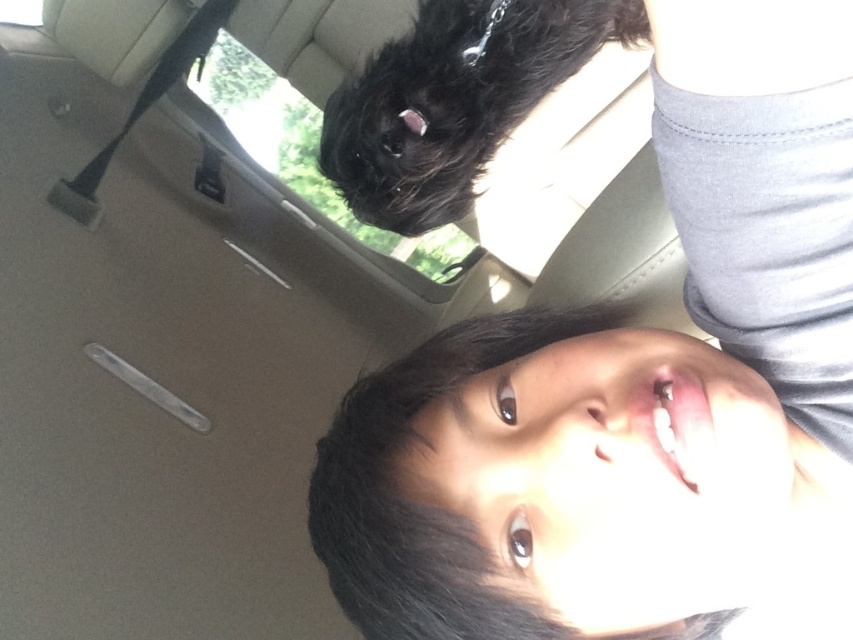
You are a passenger in the backseat of a car. You notice a smooth skin face at center and a transparent glass window at upper center. Which object is closer to the camera?

The smooth skin face at center is closer to the camera because it is positioned below the transparent glass window at upper center, meaning it is in front of the window.

From the picture: You are sitting in the backseat of a car and want to reach a point that is 23.00 inches away from you. The coordinates of this point are given as point (415,422). Can you estimate whether this point is within your arm reach?

The point (415,422) is 23.00 inches away from you. Whether it is within arm reach depends on your arm length, but the distance is approximately 23 inches. If your arm can extend that far, you can reach it.